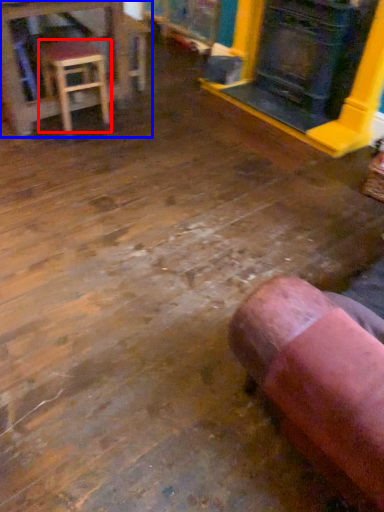
Question: Which object appears closest to the camera in this image, stool (highlighted by a red box) or table (highlighted by a blue box)?

Choices:
 (A) stool
 (B) table

Answer: (A)